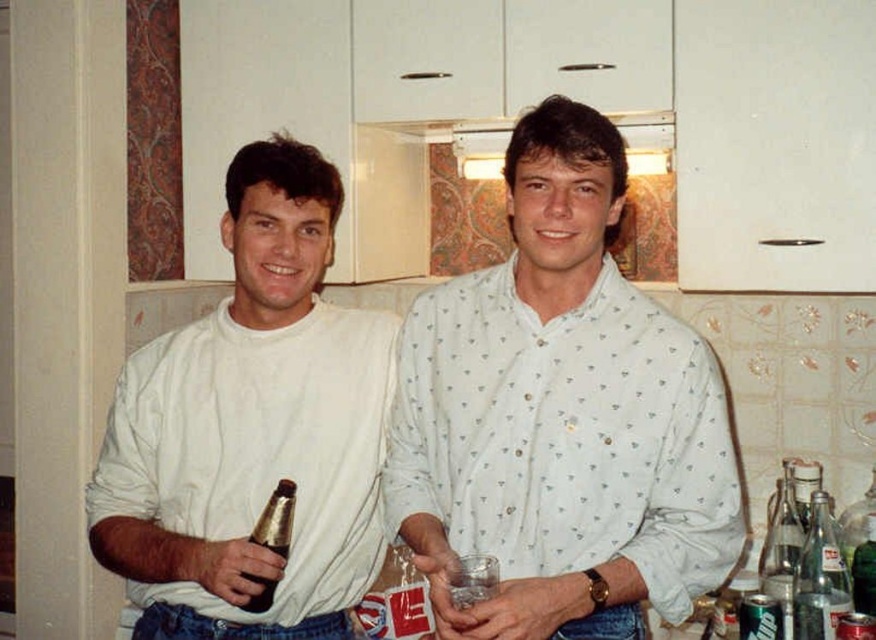
You are a delivery person who needs to place a small package between the white dotted shirt at center and the brown glass bottle at lower left. Can you fit the package if it measures 40 centimeters in length?

The distance between the white dotted shirt at center and the brown glass bottle at lower left is 41.56 centimeters. Since the package is 40 centimeters long, it can fit within the available space.

You are a bartender who needs to place a new clear glass soda bottle at right on a shelf. The existing clear glass soda at right is already on the shelf. Can you place the new bottle on the shelf without moving the existing soda?

The clear glass soda bottle at right is located above clear glass soda at right, so there is space below the existing soda to place the new bottle on the shelf.